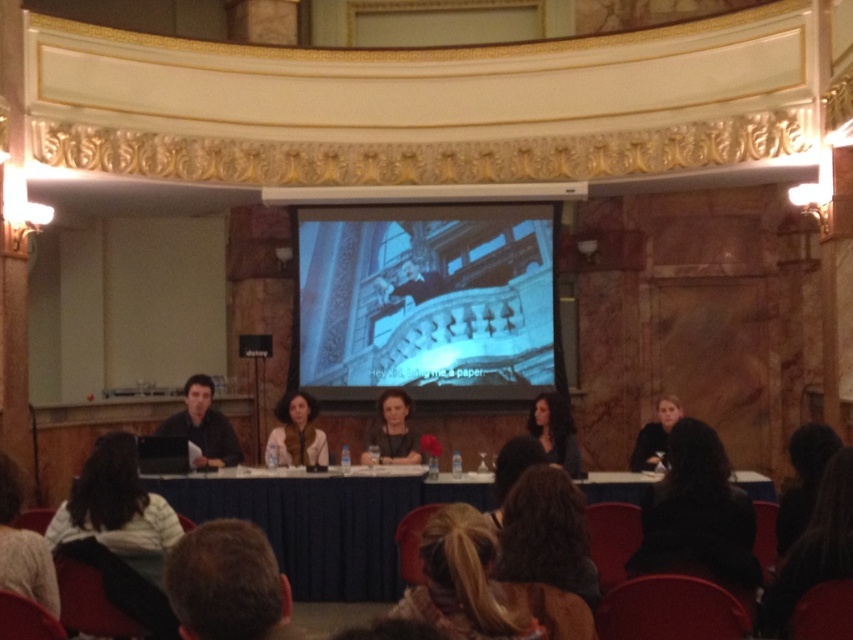
I want to click on matte black screen at center, so click(x=426, y=300).

You are a GUI agent. You are given a task and a screenshot of the screen. Output one action in this format:
    pyautogui.click(x=<x>, y=<y>)
    Task: Click on the matte black screen at center
    The height and width of the screenshot is (640, 853).
    Given the screenshot: What is the action you would take?
    pyautogui.click(x=426, y=300)

Which is behind, point (675, 442) or point (289, 408)?

Point (289, 408)

Is dark brown hair at lower right wider than brown suede jacket at center?

Yes, dark brown hair at lower right is wider than brown suede jacket at center.

The height and width of the screenshot is (640, 853). Describe the element at coordinates (698, 515) in the screenshot. I see `dark brown hair at lower right` at that location.

The width and height of the screenshot is (853, 640). I want to click on dark brown hair at lower right, so click(698, 515).

Does dark brown hair at lower right have a smaller size compared to blonde hair at lower center?

No.

Is dark brown hair at lower right further to camera compared to blonde hair at lower center?

Yes, it is behind blonde hair at lower center.

Where is `dark brown hair at lower right`? dark brown hair at lower right is located at coordinates (698, 515).

At what (x,y) coordinates should I click in order to perform the action: click on dark brown hair at lower right. Please return your answer as a coordinate pair (x, y). This screenshot has height=640, width=853. Looking at the image, I should click on (698, 515).